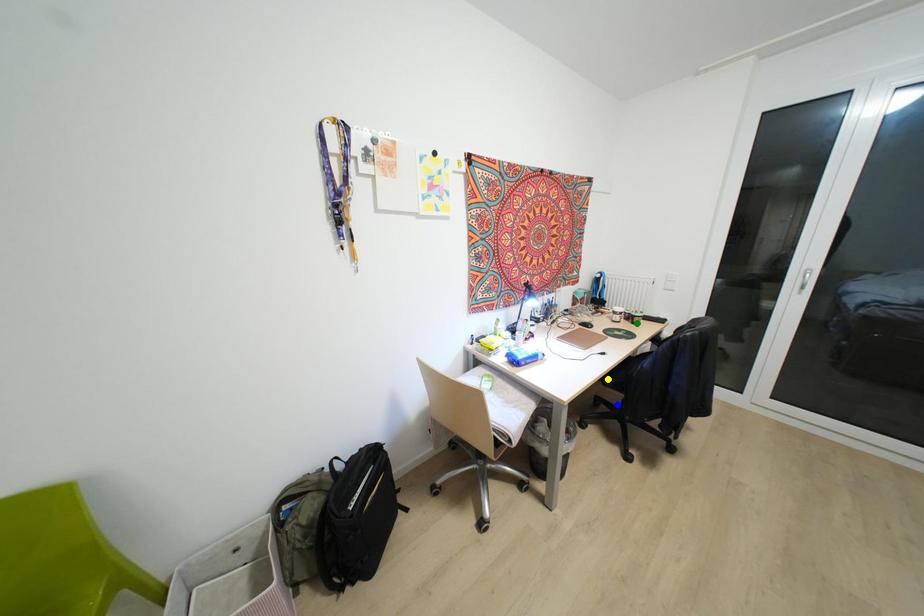
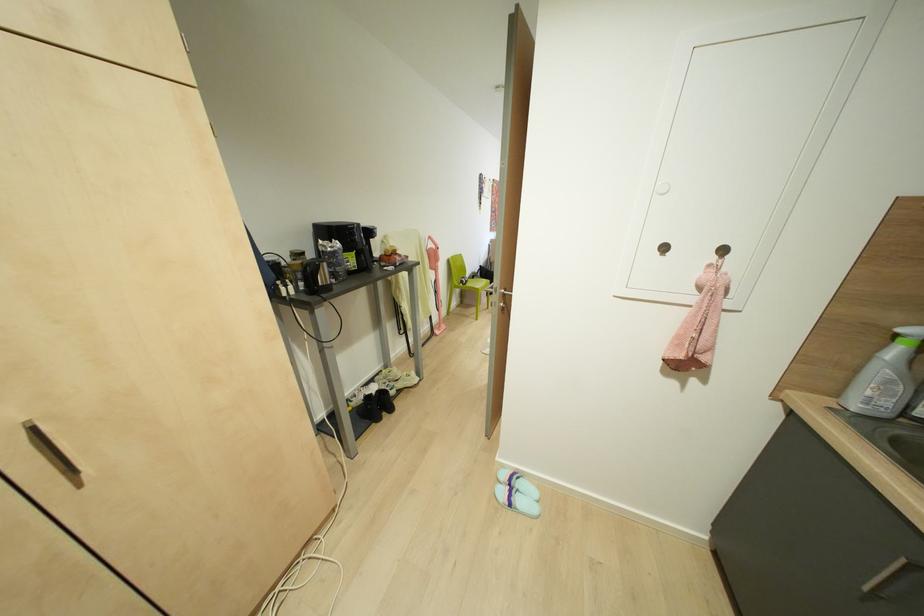
I am providing you with two images of the same scene from different viewpoints. Three points are marked in image1. Which point corresponds to a part or object that is occluded in image2?In image1, three points are marked. Which of them correspond to a part or object that is occluded in image2?Among the three points shown in image1, which one corresponds to a part or object that is no longer visible due to occlusion in image2?

blue point, green point, yellow point cannot be seen in image2.